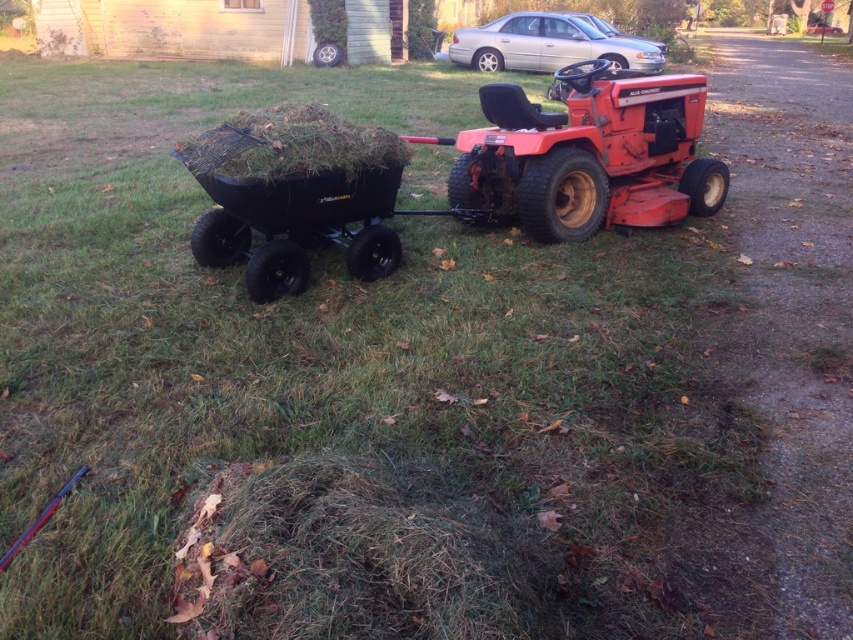
Question: Does matte red tractor at center appear under black rubber cart at center?

Choices:
 (A) no
 (B) yes

Answer: (A)

Question: Is matte red tractor at center smaller than black rubber cart at center?

Choices:
 (A) yes
 (B) no

Answer: (B)

Question: Where is matte red tractor at center located in relation to black rubber cart at center in the image?

Choices:
 (A) left
 (B) right

Answer: (B)

Question: Among these points, which one is farthest from the camera?

Choices:
 (A) (527, 150)
 (B) (405, 160)

Answer: (A)

Question: Which of the following is the closest to the observer?

Choices:
 (A) matte red tractor at center
 (B) black rubber cart at center

Answer: (B)